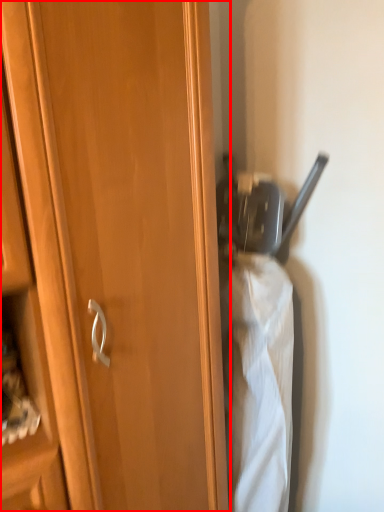
Question: Considering the relative positions of cupboard (annotated by the red box) and wide in the image provided, where is cupboard (annotated by the red box) located with respect to the staircase?

Choices:
 (A) left
 (B) right

Answer: (A)